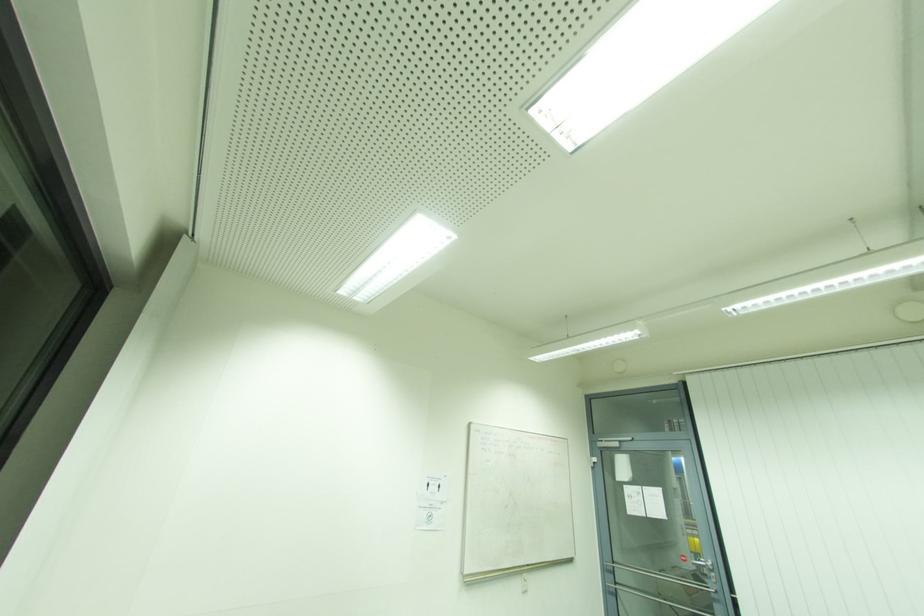
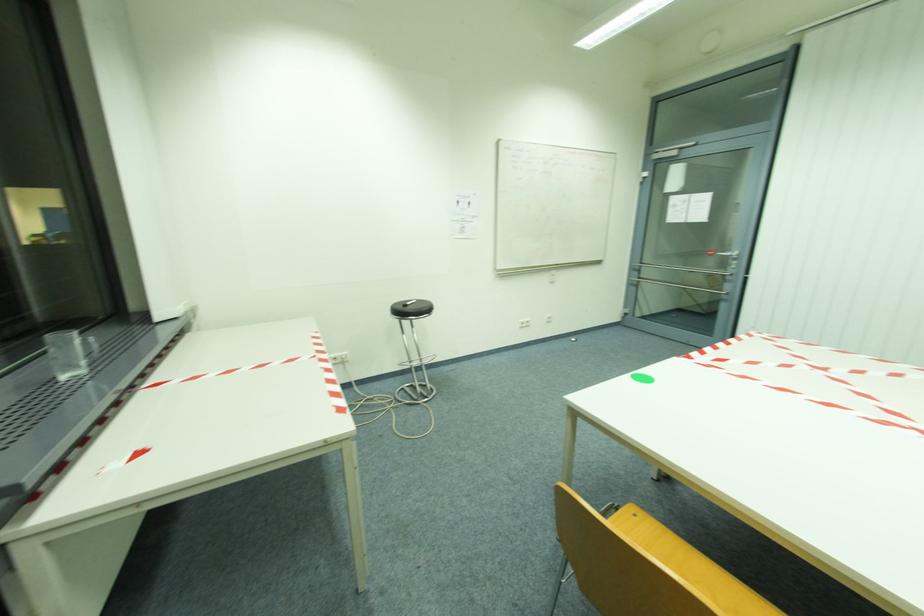
The images are taken continuously from a first-person perspective. In which direction is your viewpoint rotating?

The camera's rotation is toward left-down.